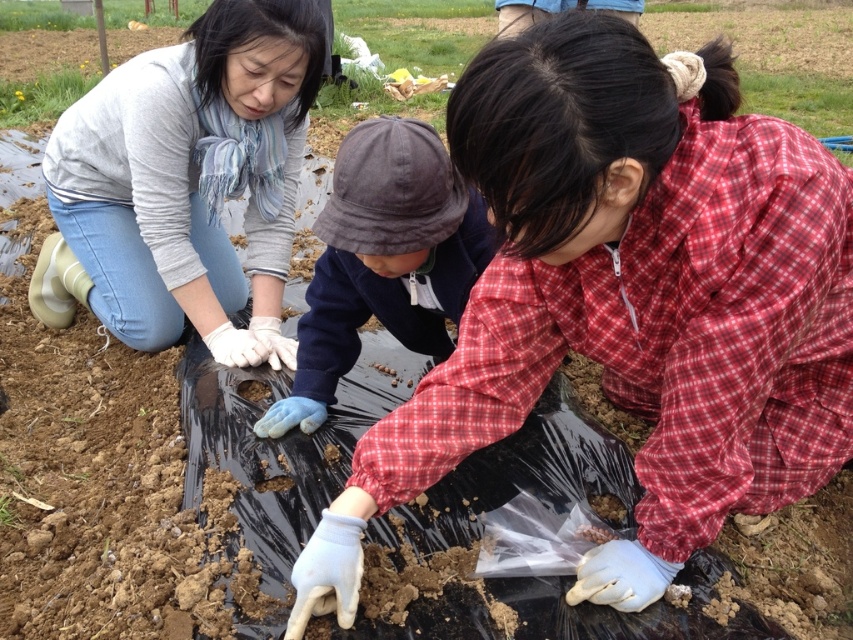
Is the position of matte gray sweater at upper left more distant than that of black plastic bag at center?

No, matte gray sweater at upper left is in front of black plastic bag at center.

Is point (254, 362) less distant than point (33, 42)?

Yes, it is.

You are a GUI agent. You are given a task and a screenshot of the screen. Output one action in this format:
    pyautogui.click(x=<x>, y=<y>)
    Task: Click on the matte gray sweater at upper left
    The height and width of the screenshot is (640, 853).
    Given the screenshot: What is the action you would take?
    (x=184, y=182)

Between point (820, 177) and point (339, 221), which one is positioned behind?

The point (339, 221) is more distant.

Can you confirm if matte red shirt at center is positioned to the right of blue cotton hat at center?

Indeed, matte red shirt at center is positioned on the right side of blue cotton hat at center.

Between point (798, 456) and point (444, 150), which one is positioned in front?

Point (444, 150) is more forward.

The width and height of the screenshot is (853, 640). I want to click on matte red shirt at center, so click(628, 300).

Can you confirm if black plastic bag at center is positioned below green grass at upper left?

Incorrect, black plastic bag at center is not positioned below green grass at upper left.

How distant is black plastic bag at center from green grass at upper left?

A distance of 4.37 meters exists between black plastic bag at center and green grass at upper left.

Is point (428, 45) more distant than point (33, 113)?

Yes, point (428, 45) is behind point (33, 113).

Locate an element on the screen. This screenshot has width=853, height=640. black plastic bag at center is located at coordinates (773, 54).